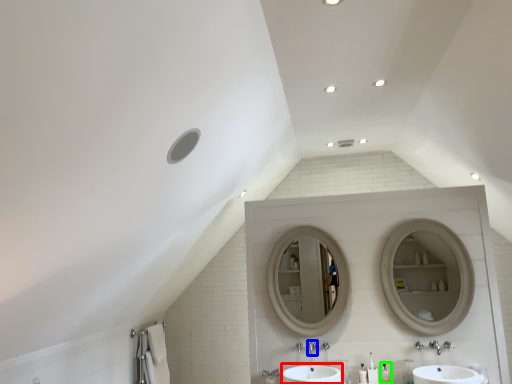
Question: Which object is the farthest from sink (highlighted by a red box)? Choose among these: plumbing fixture (highlighted by a blue box) or toiletry (highlighted by a green box).

Choices:
 (A) plumbing fixture
 (B) toiletry

Answer: (B)